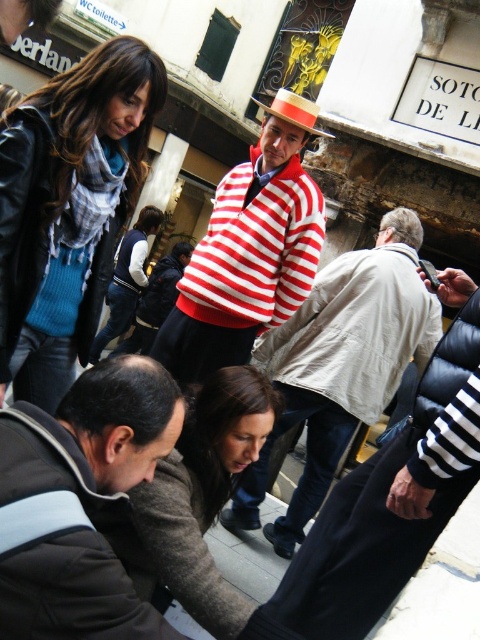
Is point (57, 218) positioned in front of point (98, 333)?

Yes, it is in front of point (98, 333).

Which is behind, point (54, 385) or point (129, 296)?

Point (129, 296)

In order to click on blue knit sweater at upper left in this screenshot , I will do `click(68, 209)`.

Find the location of `blue knit sweater at upper left`. blue knit sweater at upper left is located at coordinates (68, 209).

Does blue knit sweater at upper left appear under gray fleece jacket at lower left?

No.

The height and width of the screenshot is (640, 480). Describe the element at coordinates (68, 209) in the screenshot. I see `blue knit sweater at upper left` at that location.

Who is more distant from viewer, (132, 193) or (24, 472)?

The point (132, 193) is behind.

This screenshot has height=640, width=480. I want to click on blue knit sweater at upper left, so click(68, 209).

Is striped cotton sweater at center wider than straw hat at center?

Yes, striped cotton sweater at center is wider than straw hat at center.

Can you confirm if striped cotton sweater at center is positioned above straw hat at center?

Incorrect, striped cotton sweater at center is not positioned above straw hat at center.

You are a GUI agent. You are given a task and a screenshot of the screen. Output one action in this format:
    pyautogui.click(x=<x>, y=<y>)
    Task: Click on the striped cotton sweater at center
    The image size is (480, 640).
    Given the screenshot: What is the action you would take?
    pyautogui.click(x=249, y=252)

The width and height of the screenshot is (480, 640). I want to click on striped cotton sweater at center, so click(x=249, y=252).